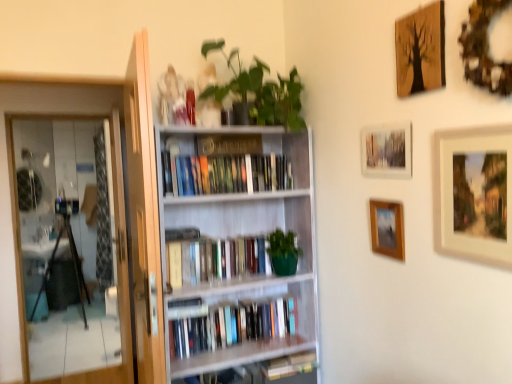
At what (x,y) coordinates should I click in order to perform the action: click on free location above hardcover books at center, which is the first book in top-to-bottom order (from a real-world perspective). Please return your answer as a coordinate pair (x, y). The image size is (512, 384). Looking at the image, I should click on (229, 150).